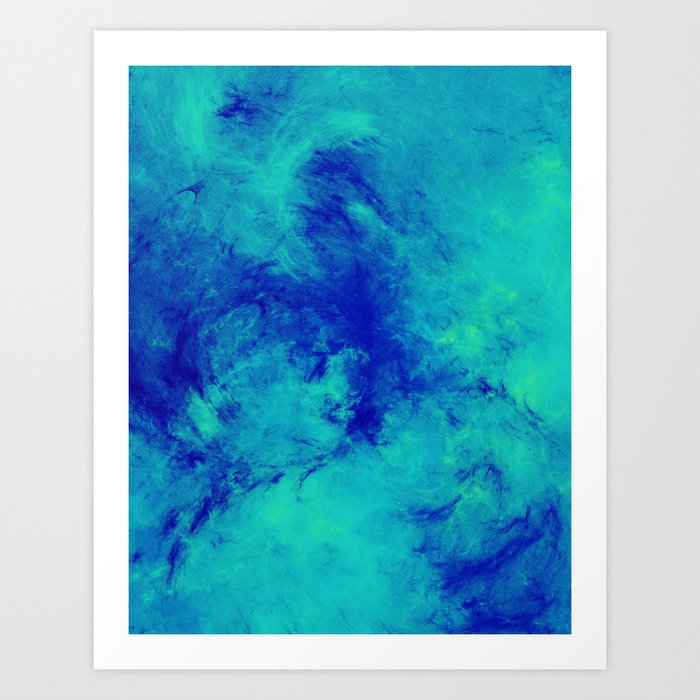
Where is `corners of painting`? The width and height of the screenshot is (700, 700). corners of painting is located at coordinates (127, 63), (568, 64), (130, 630), (568, 631).